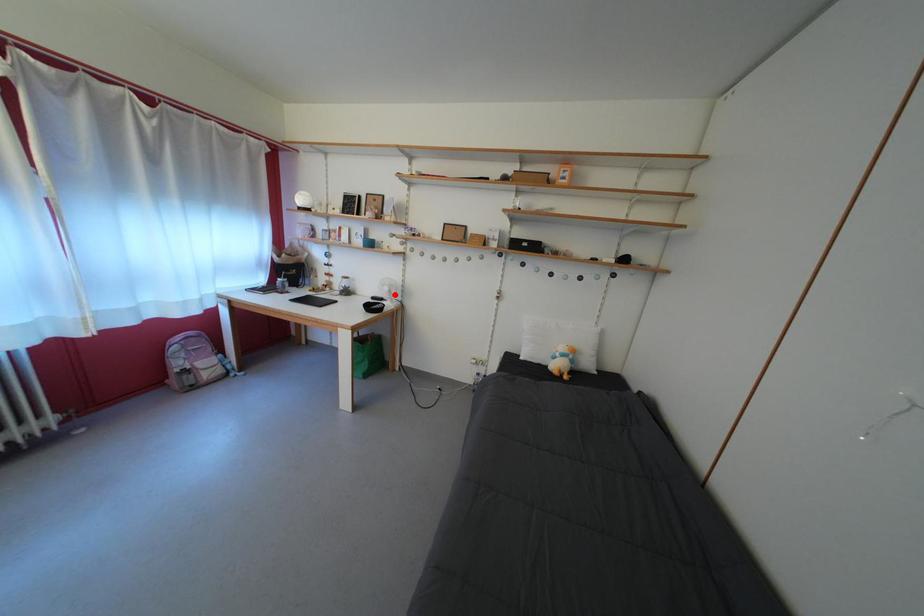
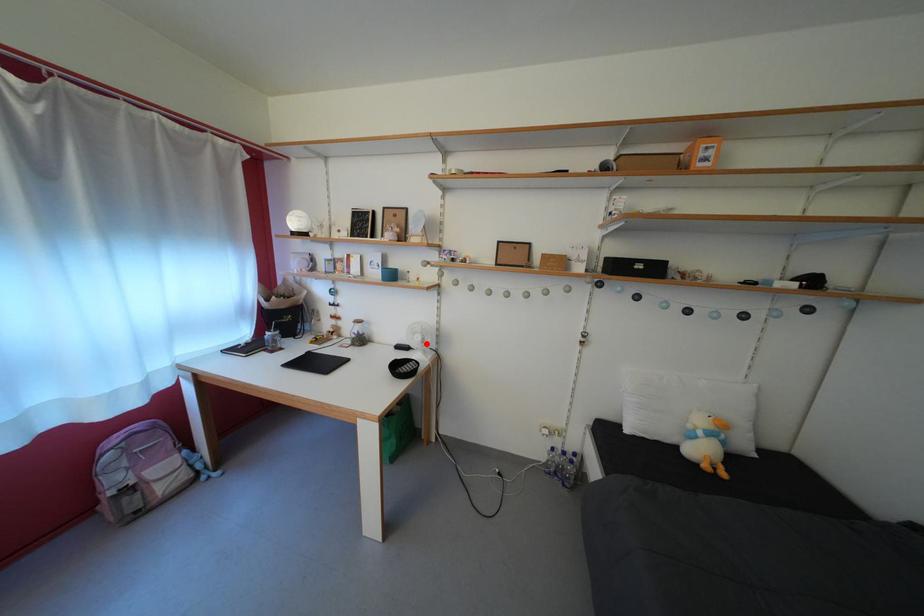
I am providing you with two images of the same scene from different viewpoints. A red point is marked on the first image and another point is marked on the second image. Is the red point in image1 aligned with the point shown in image2?

Yes